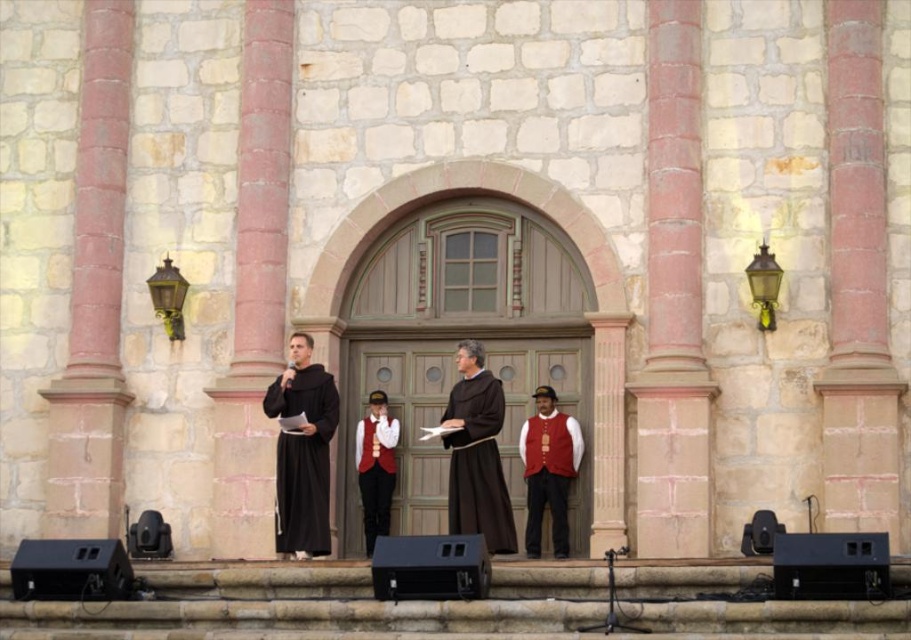
Measure the distance between matte red vest at center and camera.

matte red vest at center and camera are 50.24 meters apart from each other.

Identify the location of matte red vest at center. The height and width of the screenshot is (640, 911). [548, 474].

Does point (534, 547) come farther from viewer compared to point (390, 461)?

No, (534, 547) is in front of (390, 461).

This screenshot has width=911, height=640. In order to click on matte red vest at center in this screenshot , I will do `click(548, 474)`.

Describe the element at coordinates (303, 460) in the screenshot. I see `black matte robe at center` at that location.

Is black matte robe at center smaller than matte red vest at center?

Actually, black matte robe at center might be larger than matte red vest at center.

What are the coordinates of `black matte robe at center` in the screenshot? It's located at (303, 460).

The image size is (911, 640). Find the location of `black matte robe at center`. black matte robe at center is located at coordinates (303, 460).

The image size is (911, 640). What do you see at coordinates (303, 460) in the screenshot? I see `black matte robe at center` at bounding box center [303, 460].

Between black matte robe at center and matte black robe at center, which one appears on the right side from the viewer's perspective?

From the viewer's perspective, matte black robe at center appears more on the right side.

Which is behind, point (323, 518) or point (457, 416)?

The point (457, 416) is behind.

The height and width of the screenshot is (640, 911). Find the location of `black matte robe at center`. black matte robe at center is located at coordinates (303, 460).